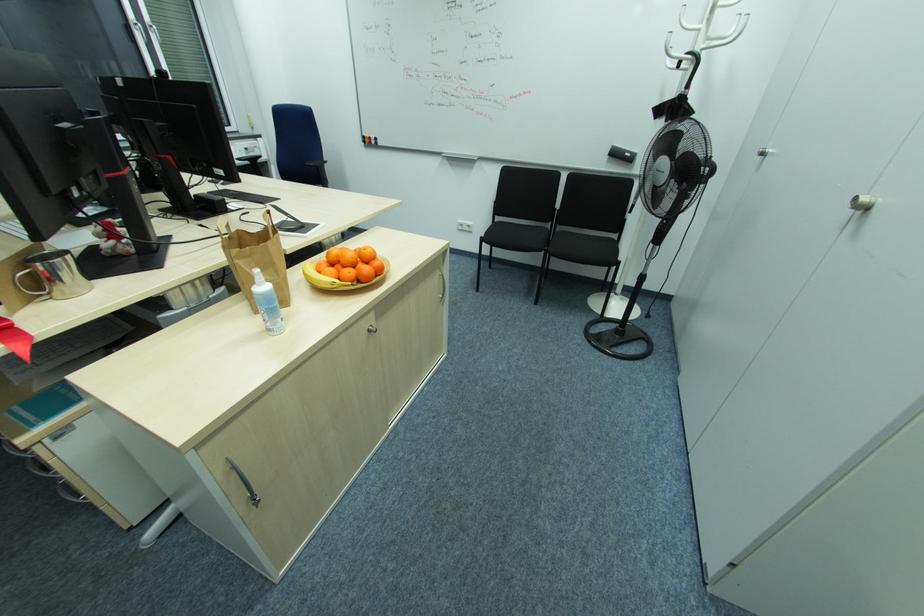
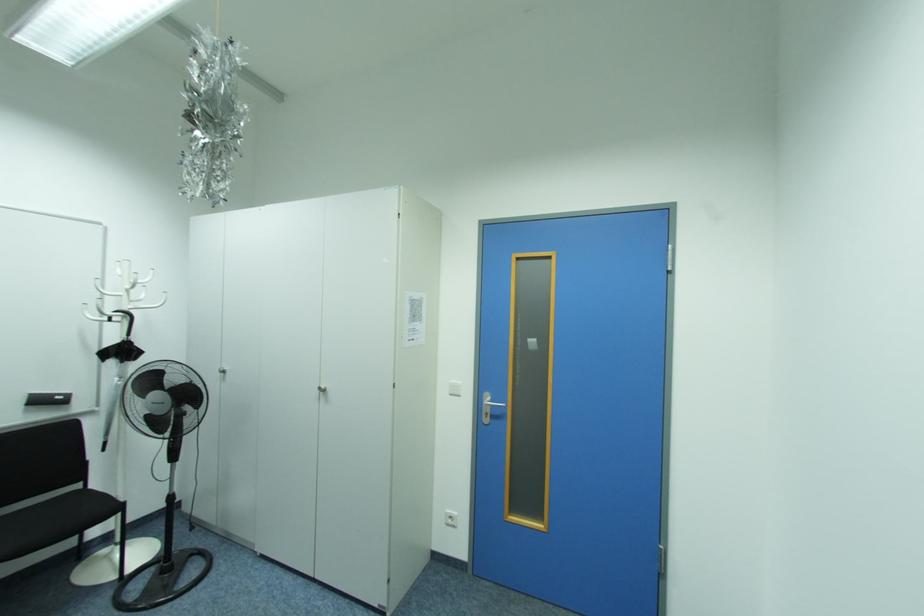
Question: How did the camera likely rotate?

Choices:
 (A) Left
 (B) Right
 (C) Up
 (D) Down

Answer: (B)